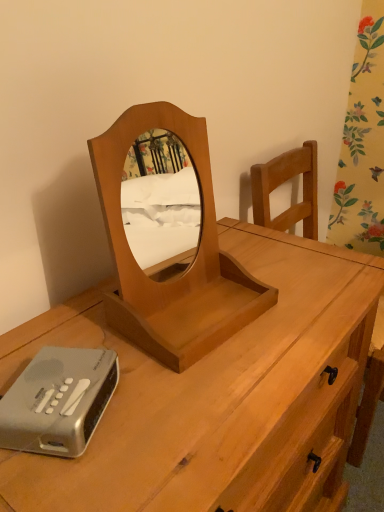
Question: From a real-world perspective, is silver plastic alarm clock at lower left under light brown wood mirror at center?

Choices:
 (A) yes
 (B) no

Answer: (A)

Question: Is silver plastic alarm clock at lower left thinner than light brown wood mirror at center?

Choices:
 (A) yes
 (B) no

Answer: (A)

Question: Is silver plastic alarm clock at lower left far away from light brown wood mirror at center?

Choices:
 (A) no
 (B) yes

Answer: (A)

Question: Can you confirm if silver plastic alarm clock at lower left is bigger than light brown wood mirror at center?

Choices:
 (A) no
 (B) yes

Answer: (A)

Question: Is silver plastic alarm clock at lower left at the right side of light brown wood mirror at center?

Choices:
 (A) yes
 (B) no

Answer: (B)

Question: Is silver plastic alarm clock at lower left to the left of light brown wood mirror at center from the viewer's perspective?

Choices:
 (A) no
 (B) yes

Answer: (B)

Question: Can you confirm if light brown wood mirror at center is shorter than silver plastic alarm clock at lower left?

Choices:
 (A) yes
 (B) no

Answer: (B)

Question: Is light brown wood mirror at center to the right of silver plastic alarm clock at lower left from the viewer's perspective?

Choices:
 (A) yes
 (B) no

Answer: (A)

Question: Is light brown wood mirror at center thinner than silver plastic alarm clock at lower left?

Choices:
 (A) yes
 (B) no

Answer: (B)

Question: Is light brown wood mirror at center behind silver plastic alarm clock at lower left?

Choices:
 (A) no
 (B) yes

Answer: (A)

Question: Is light brown wood mirror at center positioned before silver plastic alarm clock at lower left?

Choices:
 (A) yes
 (B) no

Answer: (A)

Question: Considering the relative sizes of light brown wood mirror at center and silver plastic alarm clock at lower left in the image provided, is light brown wood mirror at center wider than silver plastic alarm clock at lower left?

Choices:
 (A) no
 (B) yes

Answer: (B)

Question: Can you confirm if light brown wood mirror at center is bigger than light brown wood desk at center?

Choices:
 (A) no
 (B) yes

Answer: (A)